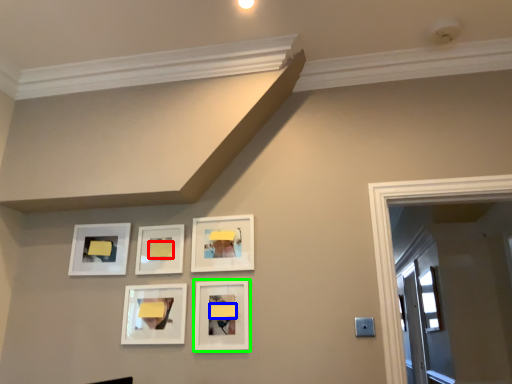
Question: Which object is positioned closest to lift (highlighted by a red box)? Select from lift (highlighted by a blue box) and picture frame (highlighted by a green box).

Choices:
 (A) lift
 (B) picture frame

Answer: (A)